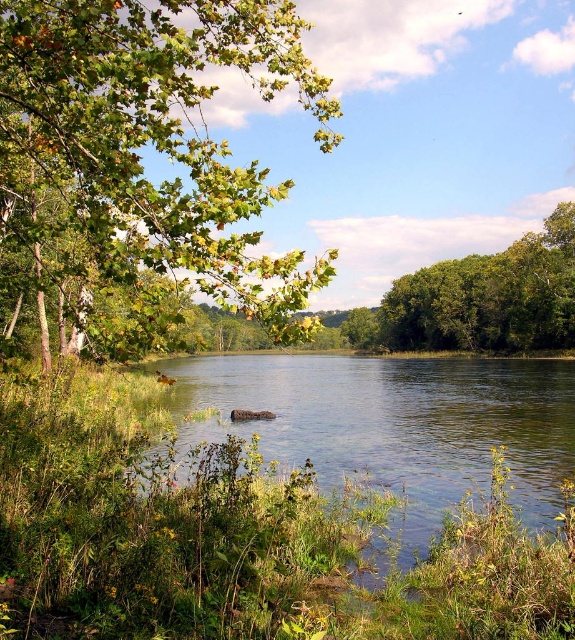
Between point (208, 51) and point (547, 515), which one is positioned behind?

The point (547, 515) is behind.

Can you confirm if green leafy branch at upper left is smaller than green grassy river at center?

No, green leafy branch at upper left is not smaller than green grassy river at center.

Locate an element on the screen. The height and width of the screenshot is (640, 575). green leafy branch at upper left is located at coordinates (141, 170).

Can you confirm if green grassy river at center is smaller than green leafy tree at right?

Indeed, green grassy river at center has a smaller size compared to green leafy tree at right.

Is green grassy river at center thinner than green leafy tree at right?

Incorrect, green grassy river at center's width is not less than green leafy tree at right's.

Is point (184, 444) less distant than point (540, 317)?

Yes, it is.

The image size is (575, 640). I want to click on green grassy river at center, so click(x=392, y=424).

Between point (205, 237) and point (546, 275), which one is positioned in front?

Point (205, 237)

Who is taller, green leafy branch at upper left or green leafy tree at right?

With more height is green leafy branch at upper left.

Does point (49, 269) lie in front of point (536, 234)?

That is True.

The height and width of the screenshot is (640, 575). I want to click on green leafy branch at upper left, so click(141, 170).